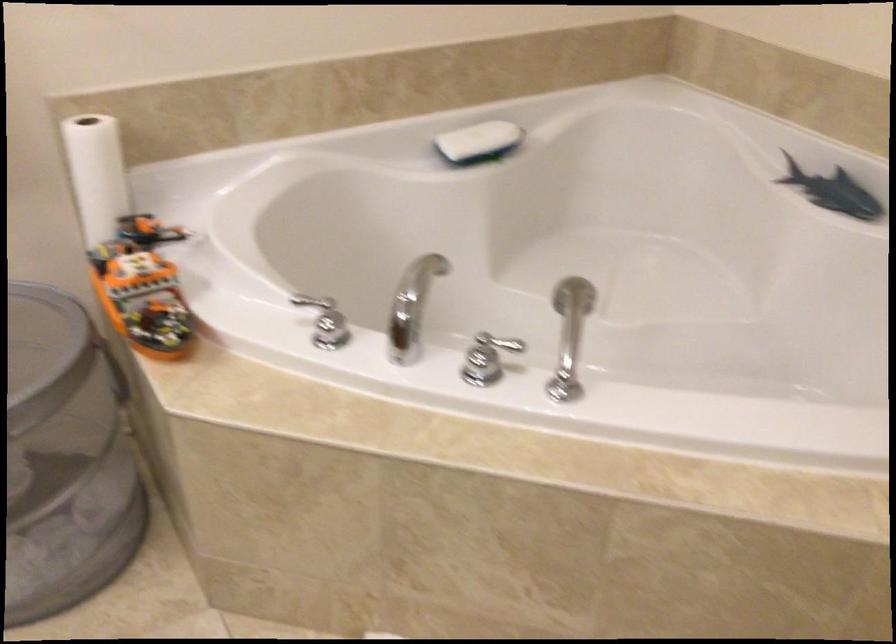
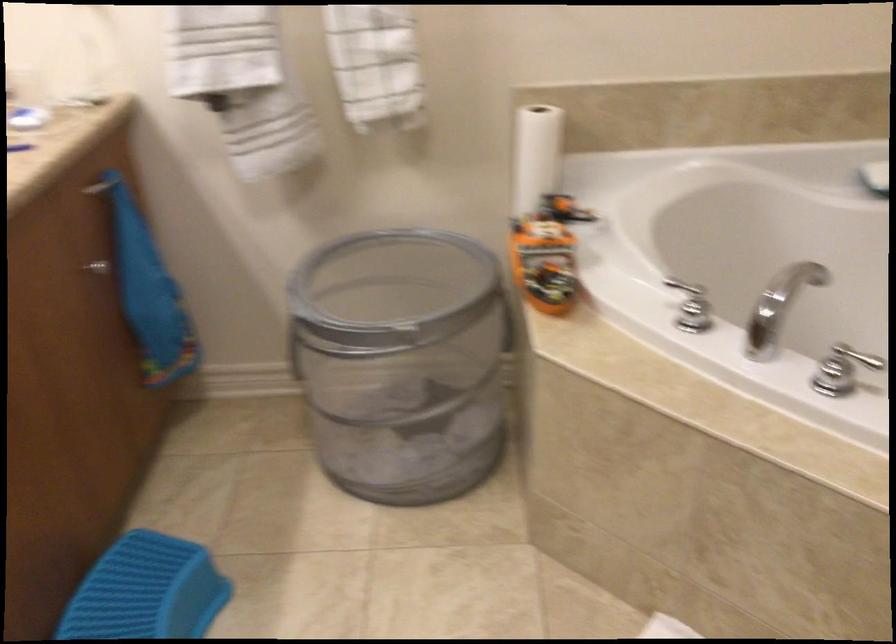
Find the pixel in the second image that matches (487,357) in the first image.

(842, 370)